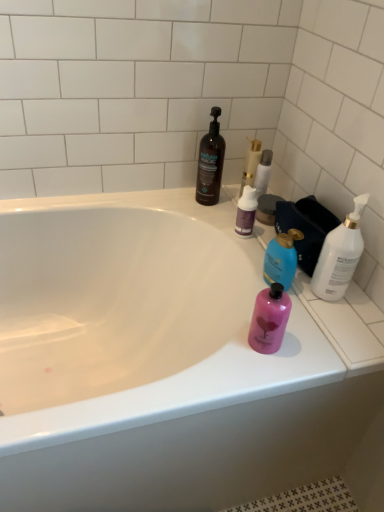
Find the location of a particular element. The width and height of the screenshot is (384, 512). free spot behind blue glossy bottle at upper right, the second bottle in the right-to-left sequence is located at coordinates (248, 241).